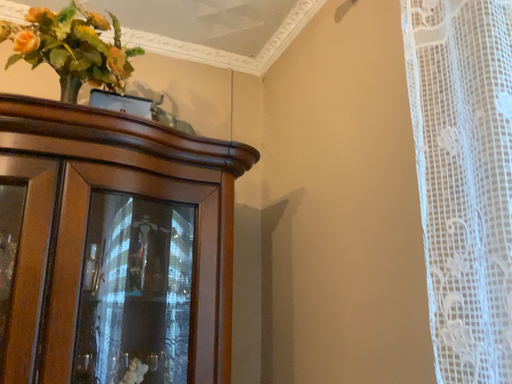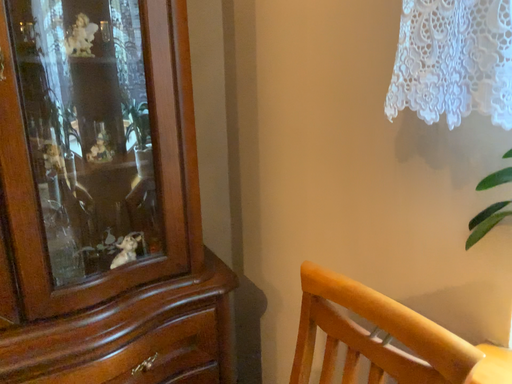
Question: How did the camera likely rotate when shooting the video?

Choices:
 (A) rotated upward
 (B) rotated downward

Answer: (B)